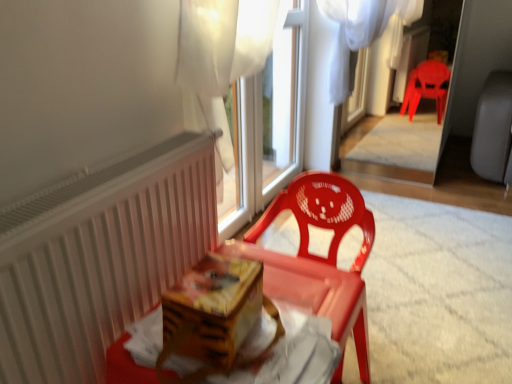
Question: From a real-world perspective, is white plastic window frame at upper center positioned above or below white matte radiator at left?

Choices:
 (A) below
 (B) above

Answer: (B)

Question: Is point (285, 165) positioned closer to the camera than point (66, 375)?

Choices:
 (A) farther
 (B) closer

Answer: (A)

Question: Which object is the farthest from the white sheer curtain at upper center?

Choices:
 (A) white plastic window frame at upper center
 (B) matte plastic chair at center
 (C) wooden at center
 (D) white matte radiator at left

Answer: (A)

Question: Which object is the closest to the white matte radiator at left?

Choices:
 (A) matte plastic chair at center
 (B) white plastic window frame at upper center
 (C) white sheer curtain at upper center
 (D) wooden at center

Answer: (D)